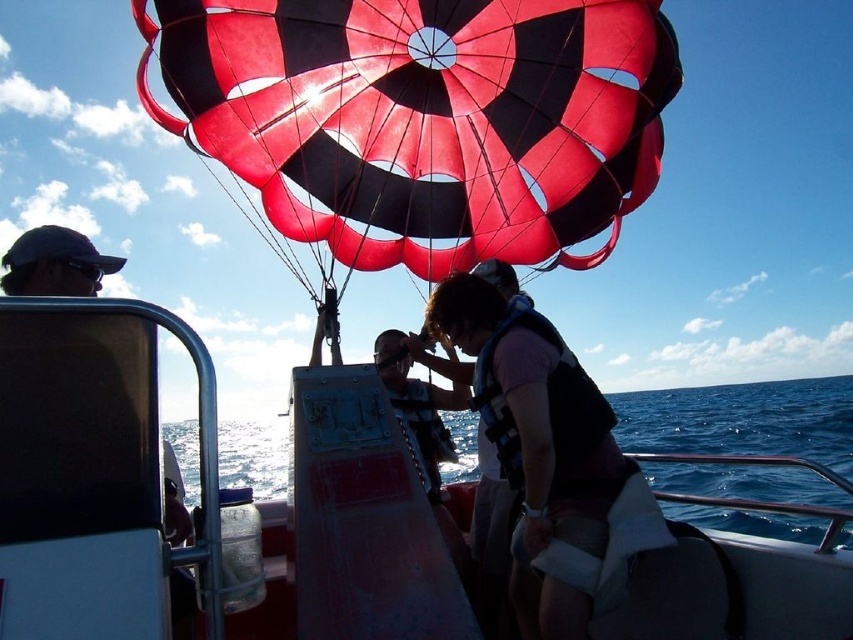
Is metallic red boat at center to the left of blue water at center from the viewer's perspective?

Indeed, metallic red boat at center is positioned on the left side of blue water at center.

Between point (120, 368) and point (844, 506), which one is positioned in front?

Positioned in front is point (120, 368).

Find the location of a particular element. metallic red boat at center is located at coordinates (200, 493).

Between metallic red boat at center and matte pink life vest at center, which one has less height?

With less height is matte pink life vest at center.

Can you confirm if metallic red boat at center is positioned below matte pink life vest at center?

Incorrect, metallic red boat at center is not positioned below matte pink life vest at center.

Does point (76, 580) come behind point (563, 506)?

No, it is not.

Find the location of `metallic red boat at center`. metallic red boat at center is located at coordinates (200, 493).

Between blue water at center and matte pink life vest at center, which one has less height?

matte pink life vest at center is shorter.

Describe the element at coordinates (743, 419) in the screenshot. I see `blue water at center` at that location.

Describe the element at coordinates (743, 419) in the screenshot. I see `blue water at center` at that location.

Locate an element on the screen. The height and width of the screenshot is (640, 853). blue water at center is located at coordinates (743, 419).